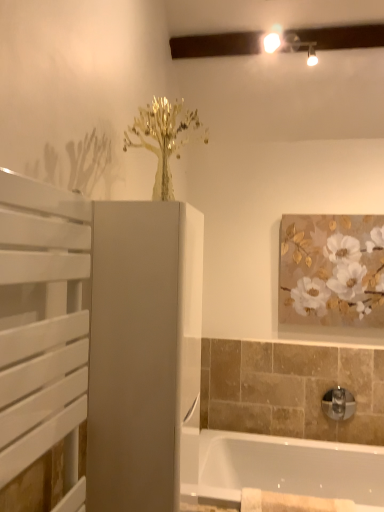
Question: Considering their positions, is gold textured painting at upper right located in front of or behind chrome metallic tap at lower right?

Choices:
 (A) front
 (B) behind

Answer: (B)

Question: Considering the positions of gold textured painting at upper right and chrome metallic tap at lower right in the image, is gold textured painting at upper right bigger or smaller than chrome metallic tap at lower right?

Choices:
 (A) small
 (B) big

Answer: (B)

Question: Estimate the real-world distances between objects in this image. Which object is closer to the beige cotton towel at lower center?

Choices:
 (A) gold textured painting at upper right
 (B) matte white cabinet at center, which appears as the 1th screen door when viewed from the back
 (C) white slatted screen door at left, the 1th screen door from the left
 (D) chrome metallic tap at lower right
 (E) white glossy bathtub at lower right

Answer: (E)

Question: Which is nearer to the chrome metallic tap at lower right?

Choices:
 (A) white glossy bathtub at lower right
 (B) beige cotton towel at lower center
 (C) white slatted screen door at left, which appears as the 1th screen door when viewed from the front
 (D) matte white cabinet at center, the 2th screen door viewed from the front
 (E) gold textured painting at upper right

Answer: (A)